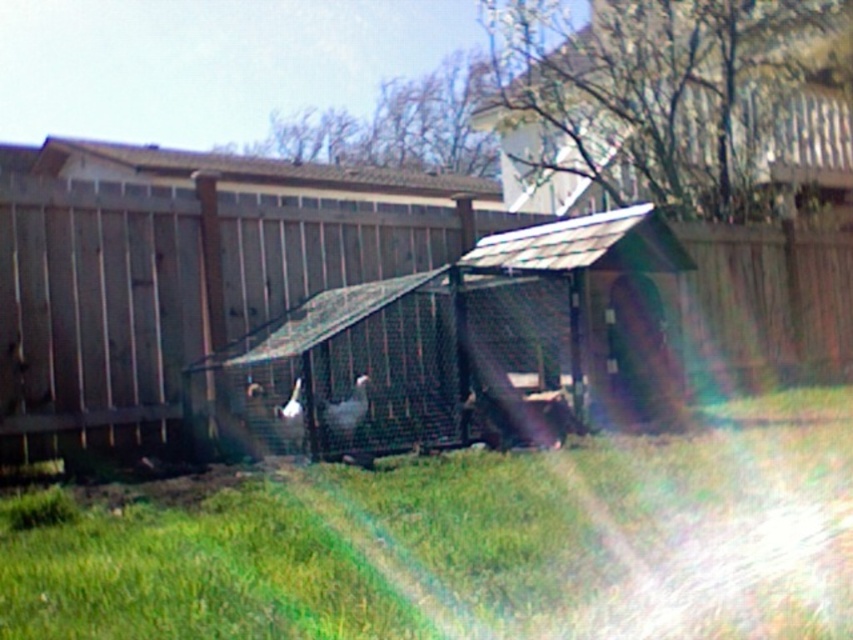
Question: Is green grass at center to the left of metallic gray hut at center from the viewer's perspective?

Choices:
 (A) no
 (B) yes

Answer: (B)

Question: Considering the real-world distances, which object is closest to the green grass at center?

Choices:
 (A) wooden chicken coop at center
 (B) metallic gray hut at center

Answer: (B)

Question: Estimate the real-world distances between objects in this image. Which object is closer to the wooden chicken coop at center?

Choices:
 (A) metallic gray hut at center
 (B) green grass at center

Answer: (A)

Question: Is green grass at center to the right of metallic gray hut at center from the viewer's perspective?

Choices:
 (A) yes
 (B) no

Answer: (B)

Question: Which object appears closest to the camera in this image?

Choices:
 (A) green grass at center
 (B) wooden chicken coop at center
 (C) metallic gray hut at center

Answer: (A)

Question: Does green grass at center have a lesser width compared to metallic gray hut at center?

Choices:
 (A) yes
 (B) no

Answer: (A)